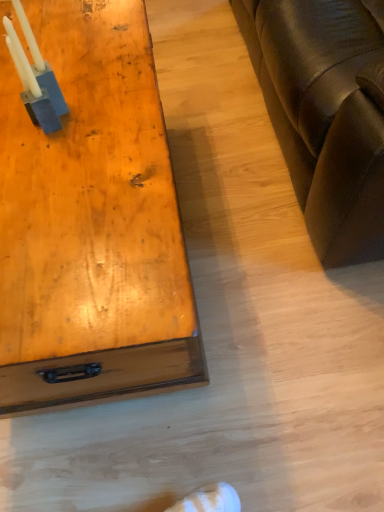
Question: Is brown leather couch at right taller or shorter than wooden table at left?

Choices:
 (A) short
 (B) tall

Answer: (B)

Question: Is brown leather couch at right inside or outside of wooden table at left?

Choices:
 (A) outside
 (B) inside

Answer: (A)

Question: Is brown leather couch at right in front of or behind wooden table at left in the image?

Choices:
 (A) front
 (B) behind

Answer: (A)

Question: In terms of size, does wooden table at left appear bigger or smaller than brown leather couch at right?

Choices:
 (A) big
 (B) small

Answer: (B)

Question: From a real-world perspective, relative to brown leather couch at right, is wooden table at left vertically above or below?

Choices:
 (A) above
 (B) below

Answer: (B)

Question: From the image's perspective, is wooden table at left positioned above or below brown leather couch at right?

Choices:
 (A) below
 (B) above

Answer: (A)

Question: Is wooden table at left wider or thinner than brown leather couch at right?

Choices:
 (A) thin
 (B) wide

Answer: (A)